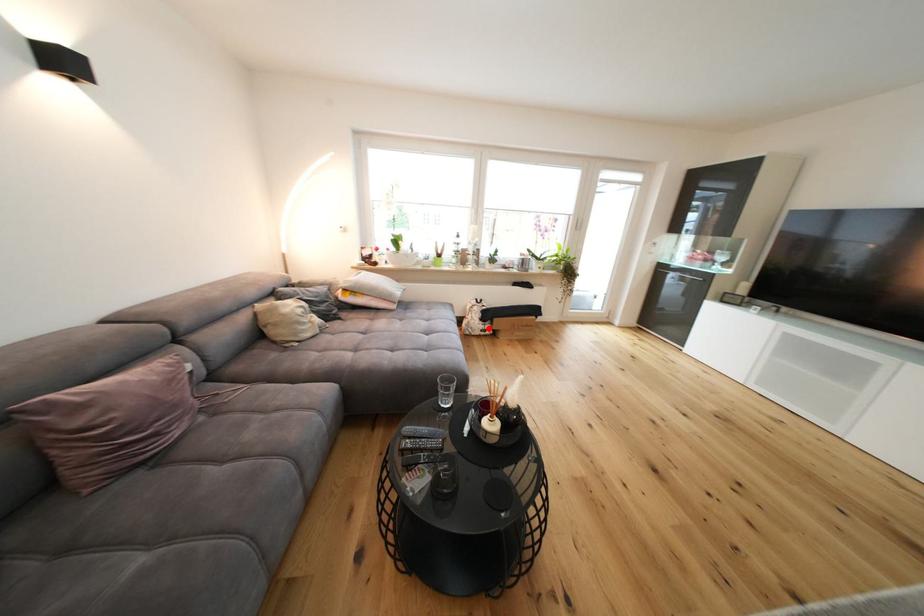
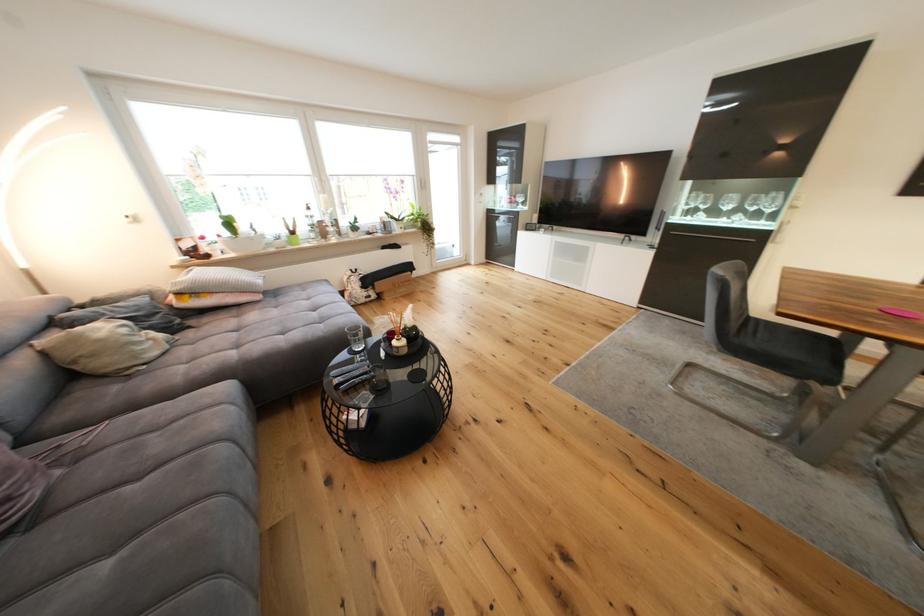
Question: I am providing you with two images of the same scene from different viewpoints. In image1, a red point is highlighted. Considering the same 3D point in image2, which of the following is correct?

Choices:
 (A) It is closer
 (B) It is farther

Answer: (A)